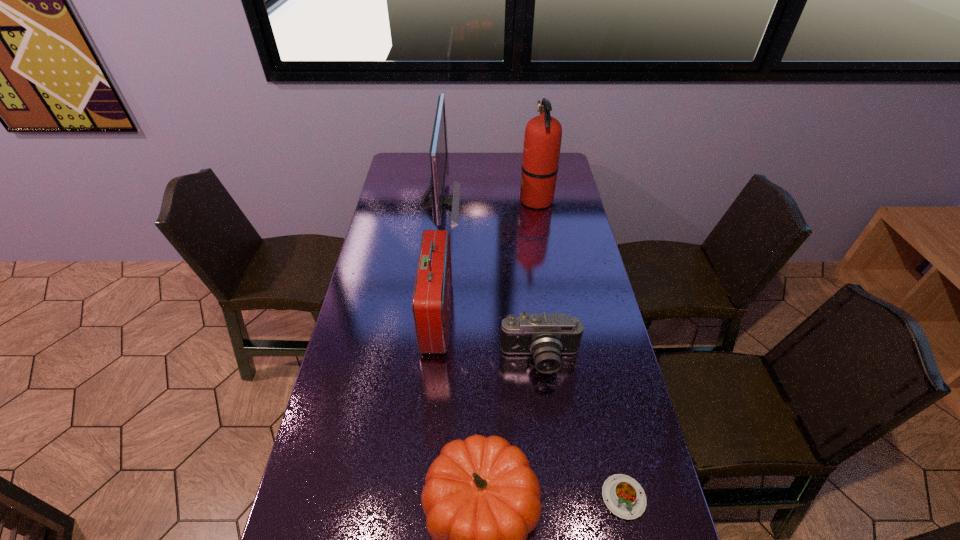
The image size is (960, 540). Find the location of `the tallest object`. the tallest object is located at coordinates click(542, 141).

Locate an element on the screen. the fifth shortest object is located at coordinates (438, 149).

Identify the location of the first-aid kit. (431, 300).

I want to click on camera, so click(546, 336).

Identify the location of the shortest object. The width and height of the screenshot is (960, 540). pos(624,497).

Find the location of a particular element. The height and width of the screenshot is (540, 960). free point located on the side of the tallest object with the nozzle and handle is located at coordinates (472, 200).

Locate an element on the screen. The image size is (960, 540). vacant region located on the side of the tallest object with the nozzle and handle is located at coordinates (466, 200).

Where is `vacant position located on the side of the tallest object with the nozzle and handle`? This screenshot has height=540, width=960. vacant position located on the side of the tallest object with the nozzle and handle is located at coordinates (436, 200).

The height and width of the screenshot is (540, 960). I want to click on vacant space located 0.140m on the screen side of the monitor, so click(x=492, y=203).

I want to click on vacant space situated 0.150m on the side of the first-aid kit with the first aid cross symbol, so click(x=496, y=316).